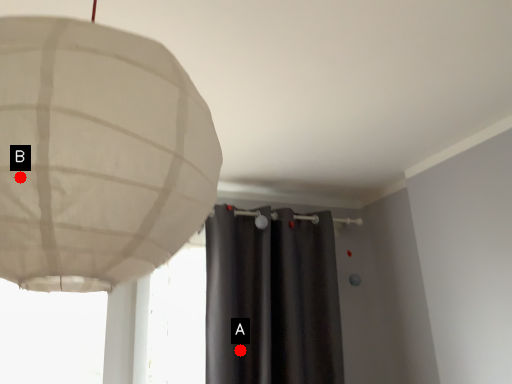
Question: Two points are circled on the image, labeled by A and B beside each circle. Which point is farther to the camera?

Choices:
 (A) A is further
 (B) B is further

Answer: (A)